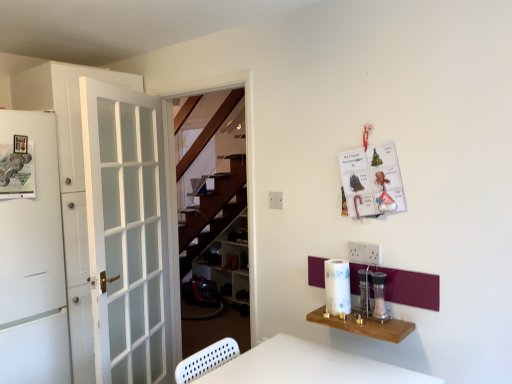
Question: Based on their sizes in the image, would you say wooden shelf at lower right is bigger or smaller than white matte refrigerator at left, placed as the 1th door when sorted from front to back?

Choices:
 (A) big
 (B) small

Answer: (B)

Question: From the image's perspective, is wooden shelf at lower right above or below white matte refrigerator at left, placed as the 1th door when sorted from front to back?

Choices:
 (A) above
 (B) below

Answer: (B)

Question: Which object is the closest to the white glass door at left, positioned as the 2th door in front-to-back order?

Choices:
 (A) metallic silver salt and pepper shakers at center right, which ranks as the 1th appliance in left-to-right order
 (B) white matte refrigerator at left, placed as the 1th door when sorted from front to back
 (C) clear glass salt and pepper shakers at right, placed as the 1th appliance when sorted from right to left
 (D) wooden shelves at center
 (E) wooden shelf at lower right

Answer: (B)

Question: Which is farther from the clear glass salt and pepper shakers at right, the second appliance in the left-to-right sequence?

Choices:
 (A) wooden shelves at center
 (B) metallic silver salt and pepper shakers at center right, which ranks as the 1th appliance in left-to-right order
 (C) white matte refrigerator at left, the 2th door from the back
 (D) white glass door at left, the 1th door in the back-to-front sequence
 (E) wooden shelf at lower right

Answer: (A)